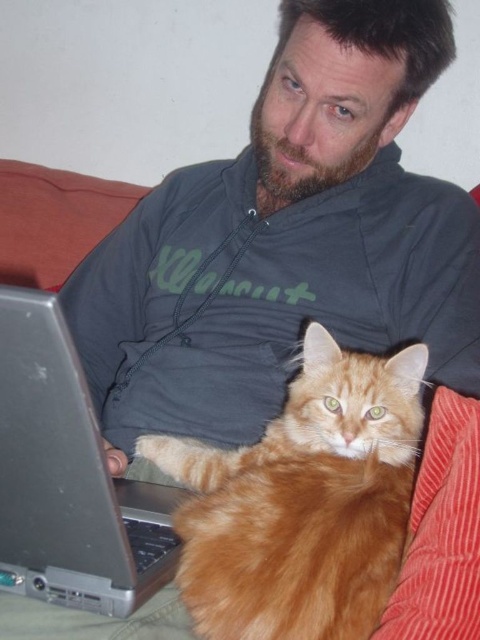
Question: Based on their relative distances, which object is nearer to the silver metallic laptop at lower left?

Choices:
 (A) dark gray hoodie at center
 (B) orange fur cat at center

Answer: (B)

Question: Is dark gray hoodie at center thinner than silver metallic laptop at lower left?

Choices:
 (A) no
 (B) yes

Answer: (A)

Question: Is dark gray hoodie at center to the right of silver metallic laptop at lower left from the viewer's perspective?

Choices:
 (A) no
 (B) yes

Answer: (B)

Question: Which object is positioned closest to the orange fur cat at center?

Choices:
 (A) silver metallic laptop at lower left
 (B) dark gray hoodie at center

Answer: (A)

Question: Is orange fur cat at center behind silver metallic laptop at lower left?

Choices:
 (A) no
 (B) yes

Answer: (B)

Question: Which of these objects is positioned closest to the dark gray hoodie at center?

Choices:
 (A) silver metallic laptop at lower left
 (B) orange fur cat at center

Answer: (B)